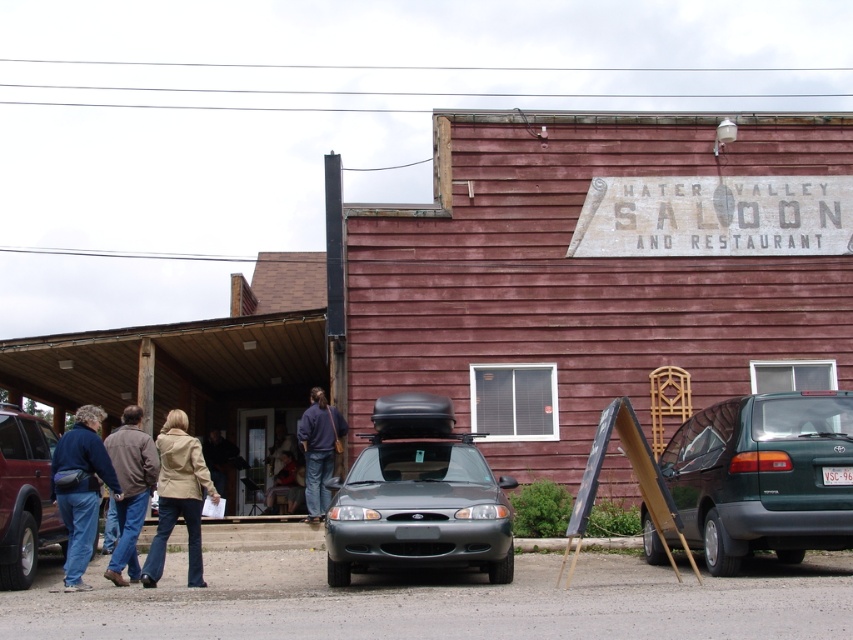
Question: Is light brown leather jacket at center wider than denim jacket at lower center?

Choices:
 (A) no
 (B) yes

Answer: (B)

Question: Which of the following is the closest to the observer?

Choices:
 (A) matte gray car at center
 (B) matte black suv at left

Answer: (A)

Question: Observing the image, what is the correct spatial positioning of matte gray car at center in reference to beige leather jacket at lower center?

Choices:
 (A) right
 (B) left

Answer: (A)

Question: Which of the following is the closest to the observer?

Choices:
 (A) green matte van at right
 (B) matte gray car at center
 (C) brown leather jacket at lower left

Answer: (A)

Question: Which point is farther to the camera?

Choices:
 (A) matte gray car at center
 (B) denim jacket at lower center
 (C) denim jacket at left
 (D) green matte van at right

Answer: (B)

Question: Can you confirm if dark blue sweater at center is wider than light brown leather jacket at center?

Choices:
 (A) no
 (B) yes

Answer: (A)